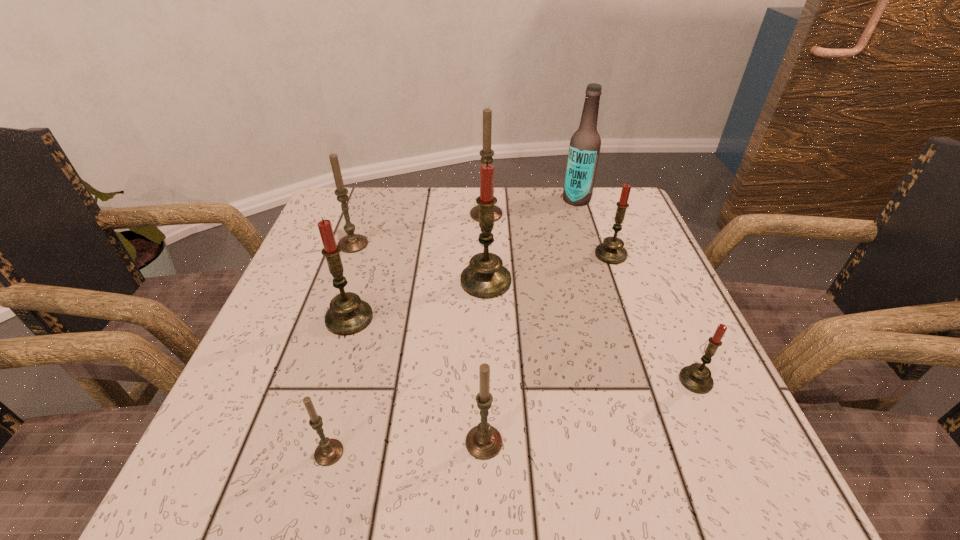
This screenshot has height=540, width=960. I want to click on object positioned at the far right corner, so click(585, 143).

Identify the location of vacant area at the far edge of the desktop. (463, 194).

In the image, there is a desktop. Where is `vacant space at the left edge`? vacant space at the left edge is located at coordinates (271, 369).

Where is `free space at the right edge of the desktop`? free space at the right edge of the desktop is located at coordinates (x=639, y=275).

Locate an element on the screen. This screenshot has height=540, width=960. vacant space at the far left corner is located at coordinates (390, 191).

This screenshot has height=540, width=960. In the image, there is a desktop. Find the location of `vacant space at the near right corner`. vacant space at the near right corner is located at coordinates (671, 491).

Where is `vacant space that is in between the third biggest gray candle and the second biggest gray candle`? vacant space that is in between the third biggest gray candle and the second biggest gray candle is located at coordinates pyautogui.click(x=419, y=343).

Where is `free space between the smallest red candle and the second gray candle from left to right`? free space between the smallest red candle and the second gray candle from left to right is located at coordinates (513, 416).

I want to click on free space that is in between the second gray candle from left to right and the second farthest gray candle, so click(x=341, y=348).

You are a GUI agent. You are given a task and a screenshot of the screen. Output one action in this format:
    pyautogui.click(x=<x>, y=<y>)
    Task: Click on the empty space between the third farthest red candle and the third nearest gray candle
    The width and height of the screenshot is (960, 540).
    Given the screenshot: What is the action you would take?
    pyautogui.click(x=351, y=281)